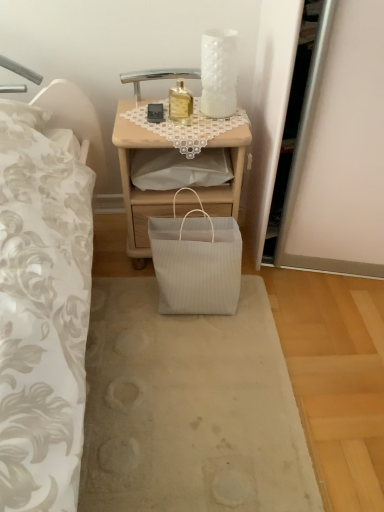
Find the location of a particular element. The width and height of the screenshot is (384, 512). vacant space to the right of gold glass bottle at upper center is located at coordinates (222, 116).